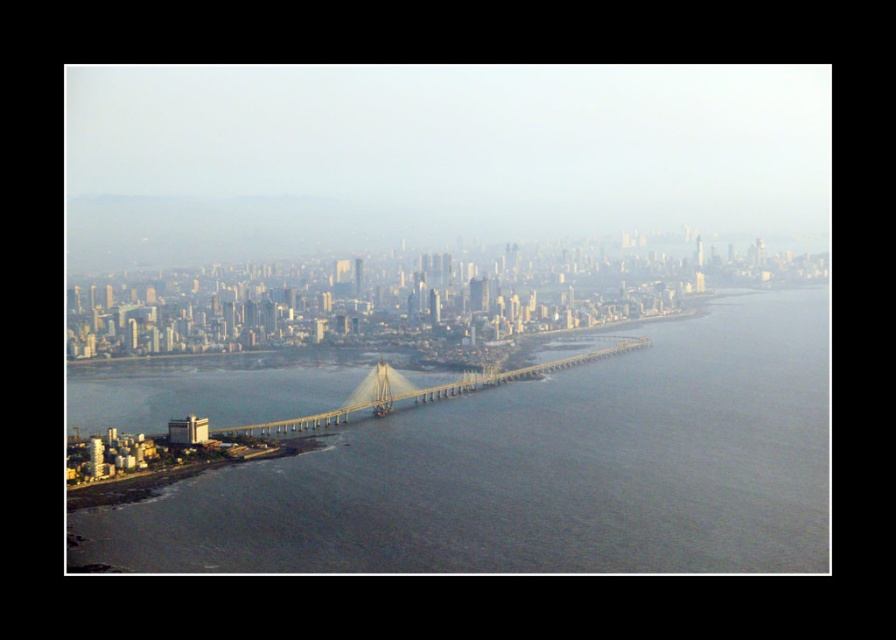
Is point (136, 548) positioned before point (294, 433)?

No, it is behind (294, 433).

The width and height of the screenshot is (896, 640). What do you see at coordinates (543, 468) in the screenshot?
I see `gray concrete bridge at center` at bounding box center [543, 468].

Which is behind, point (774, 467) or point (362, 385)?

Point (774, 467)

The image size is (896, 640). I want to click on gray concrete bridge at center, so click(x=543, y=468).